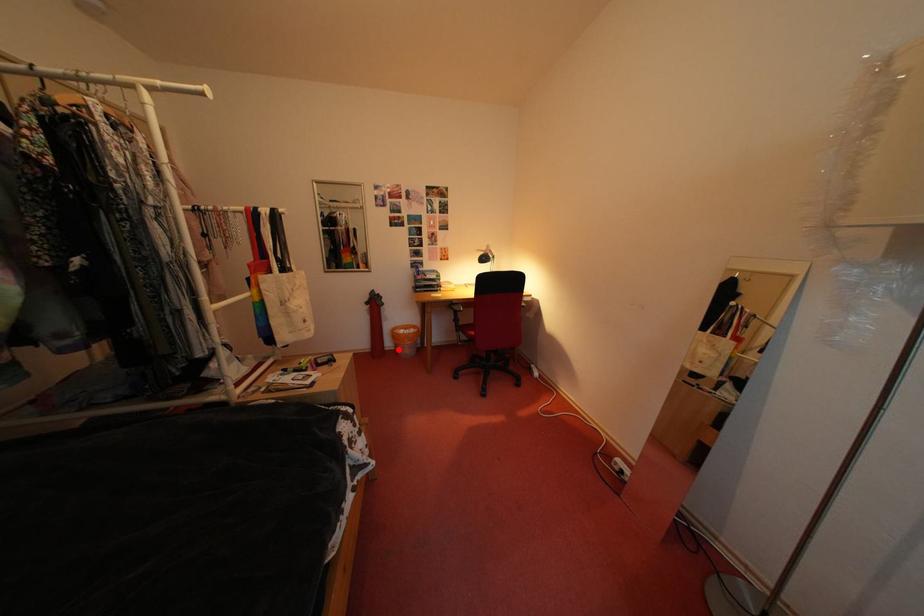
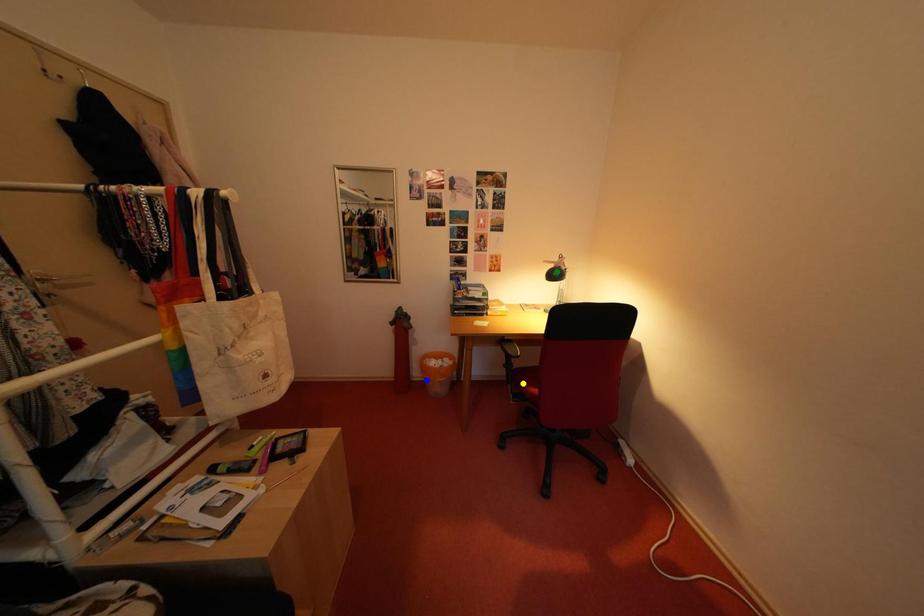
Question: I am providing you with two images of the same scene from different viewpoints. A red point is marked on the first image. You are given multiple points on the second image. Which point in image 2 is actually the same real-world point as the red point in image 1?

Choices:
 (A) green point
 (B) yellow point
 (C) blue point

Answer: (C)